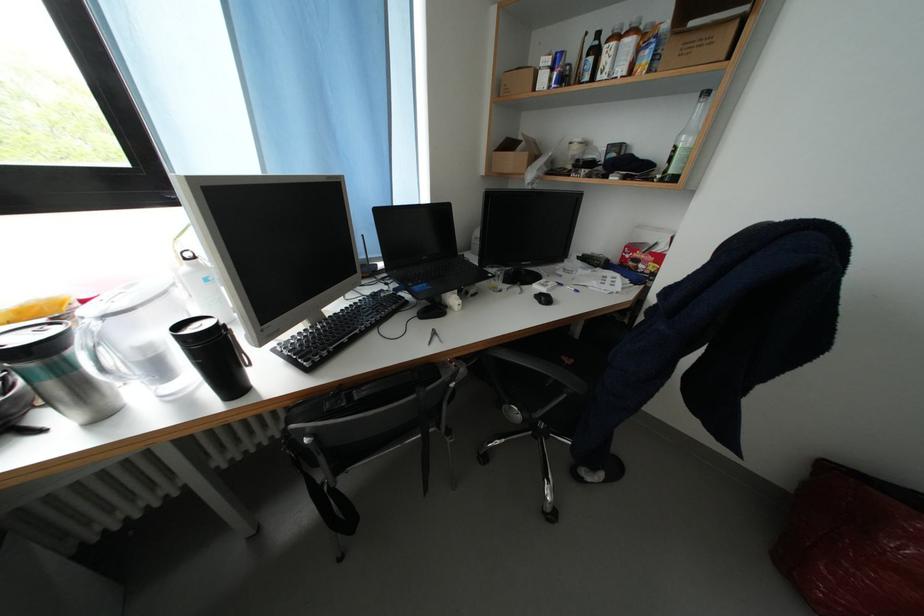
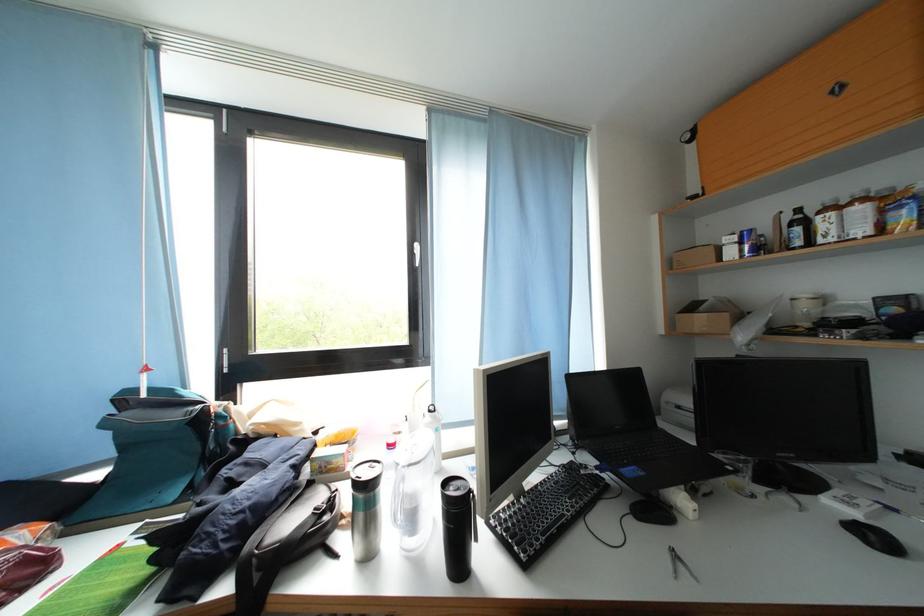
The point at (93, 307) is marked in the first image. Where is the corresponding point in the second image?

(398, 451)